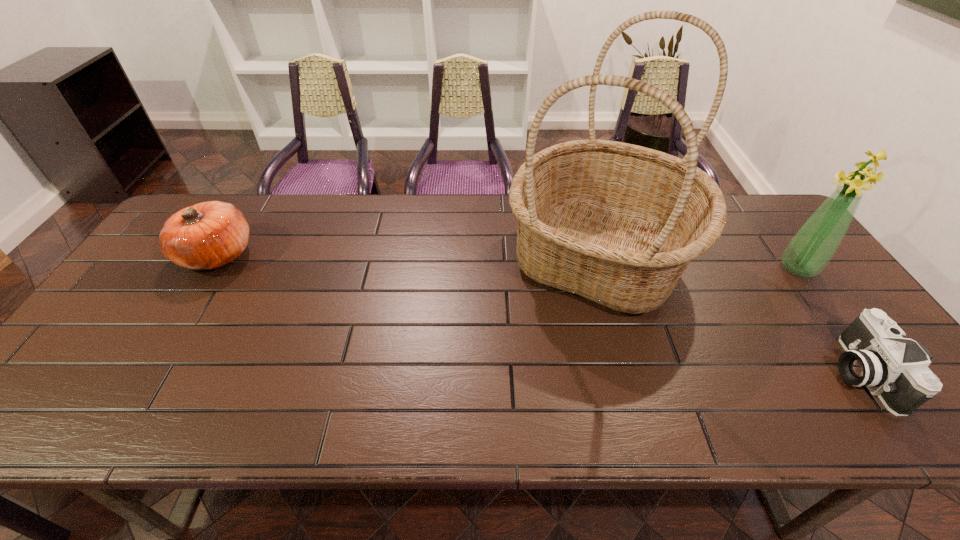
You are a GUI agent. You are given a task and a screenshot of the screen. Output one action in this format:
    pyautogui.click(x=<x>, y=<y>)
    Task: Click on the object located at the near right corner
    The height and width of the screenshot is (540, 960).
    Given the screenshot: What is the action you would take?
    pyautogui.click(x=876, y=356)

In the image, there is a desktop. At what (x,y) coordinates should I click in order to perform the action: click on vacant region at the far edge. Please return your answer as a coordinate pair (x, y). This screenshot has height=540, width=960. Looking at the image, I should click on (437, 208).

In the image, there is a desktop. Identify the location of vacant space at the near edge. (706, 397).

You are a GUI agent. You are given a task and a screenshot of the screen. Output one action in this format:
    pyautogui.click(x=<x>, y=<y>)
    Task: Click on the vacant space at the left edge of the desktop
    
    Given the screenshot: What is the action you would take?
    pyautogui.click(x=160, y=316)

Image resolution: width=960 pixels, height=540 pixels. Find the location of `vacant area at the far left corner`. vacant area at the far left corner is located at coordinates (210, 195).

You are a GUI agent. You are given a task and a screenshot of the screen. Output one action in this format:
    pyautogui.click(x=<x>, y=<y>)
    Task: Click on the vacant area at the far right corner of the desktop
    This screenshot has height=540, width=960.
    Given the screenshot: What is the action you would take?
    pyautogui.click(x=745, y=220)

Identify the location of vacant space in between the second object from left to right and the nearest object. Image resolution: width=960 pixels, height=540 pixels. (730, 315).

I want to click on vacant area that lies between the bouquet and the nearest object, so click(x=829, y=320).

Find the location of a particular element. free space that is in between the third tallest object and the second object from left to right is located at coordinates (408, 256).

I want to click on free point between the basket and the third shortest object, so click(699, 262).